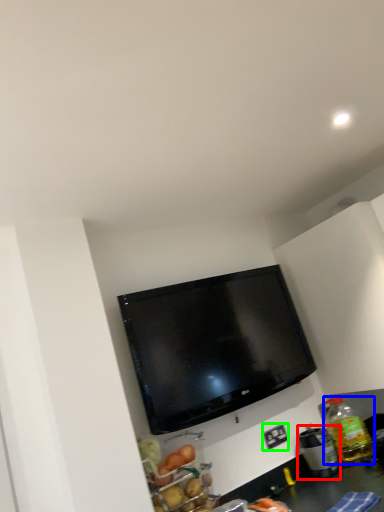
Question: Which is nearer to the appliance (highlighted by a red box)? bottle (highlighted by a blue box) or electric outlet (highlighted by a green box).

Choices:
 (A) bottle
 (B) electric outlet

Answer: (A)